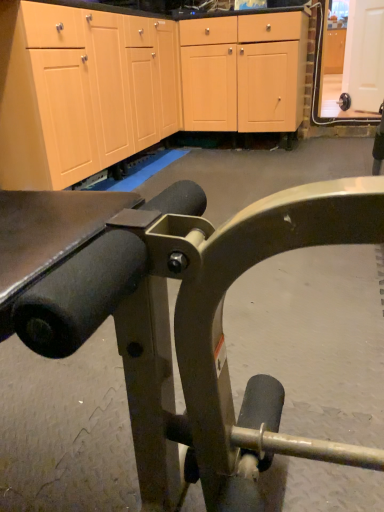
Question: In the image, is light wood/veneer cabinets at center, the 2th cabinetry when ordered from back to front, positioned in front of or behind matte wood cabinet at upper right, which appears as the second cabinetry when viewed from the front?

Choices:
 (A) front
 (B) behind

Answer: (A)

Question: Is point (276, 61) positioned closer to the camera than point (334, 46)?

Choices:
 (A) closer
 (B) farther

Answer: (A)

Question: Considering the positions of light wood/veneer cabinets at center, arranged as the 1th cabinetry when viewed from the front, and matte wood cabinet at upper right, the 2th cabinetry from the bottom, in the image, is light wood/veneer cabinets at center, arranged as the 1th cabinetry when viewed from the front, wider or thinner than matte wood cabinet at upper right, the 2th cabinetry from the bottom,?

Choices:
 (A) thin
 (B) wide

Answer: (A)

Question: Does point (342, 28) appear closer or farther from the camera than point (294, 15)?

Choices:
 (A) farther
 (B) closer

Answer: (A)

Question: Relative to light wood/veneer cabinets at center, the first cabinetry in the bottom-to-top sequence, is matte wood cabinet at upper right, which appears as the second cabinetry when viewed from the front, in front or behind?

Choices:
 (A) behind
 (B) front

Answer: (A)

Question: Considering the positions of matte wood cabinet at upper right, the 2th cabinetry from the bottom, and light wood/veneer cabinets at center, the 2th cabinetry when ordered from back to front, in the image, is matte wood cabinet at upper right, the 2th cabinetry from the bottom, wider or thinner than light wood/veneer cabinets at center, the 2th cabinetry when ordered from back to front,?

Choices:
 (A) thin
 (B) wide

Answer: (B)

Question: Is matte wood cabinet at upper right, which ranks as the first cabinetry in top-to-bottom order, taller or shorter than light wood/veneer cabinets at center, the first cabinetry positioned from the left?

Choices:
 (A) short
 (B) tall

Answer: (B)